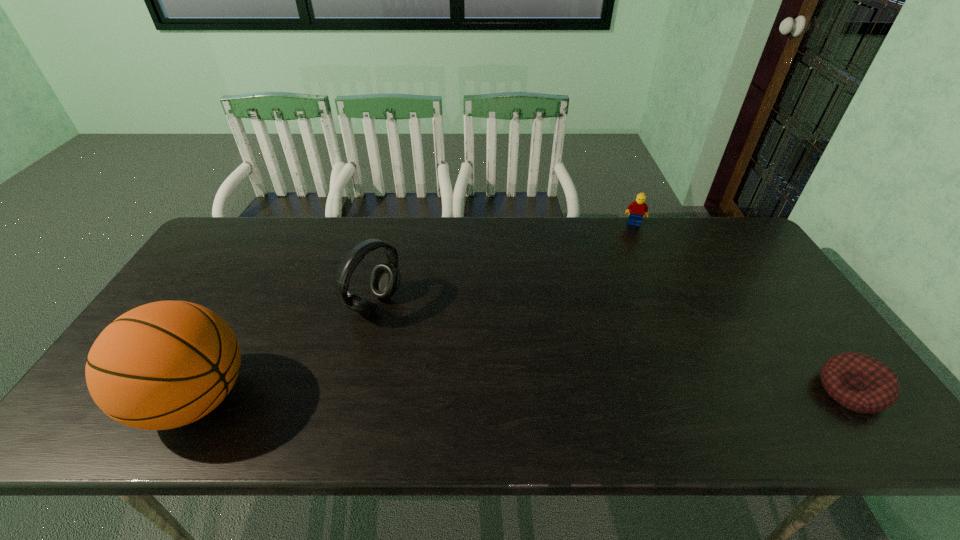
Find the location of a particular element. Image resolution: width=960 pixels, height=540 pixels. basketball is located at coordinates (166, 364).

The width and height of the screenshot is (960, 540). In order to click on the leftmost object in this screenshot , I will do `click(166, 364)`.

Locate an element on the screen. This screenshot has height=540, width=960. the rightmost object is located at coordinates (859, 382).

The height and width of the screenshot is (540, 960). What are the coordinates of `the shortest object` in the screenshot? It's located at (859, 382).

Find the location of a particular element. The width and height of the screenshot is (960, 540). the second farthest object is located at coordinates (384, 281).

Locate an element on the screen. This screenshot has width=960, height=540. the third shortest object is located at coordinates (384, 281).

The height and width of the screenshot is (540, 960). Identify the location of the second object from right to left. (636, 209).

Find the location of a particular element. The image size is (960, 540). the farthest object is located at coordinates (636, 209).

The height and width of the screenshot is (540, 960). Identify the location of vacant space located on the back of the tallest object. tap(251, 298).

You are a GUI agent. You are given a task and a screenshot of the screen. Output one action in this format:
    pyautogui.click(x=<x>, y=<y>)
    Task: Click on the vacant space situated on the left of the beanbag
    
    Given the screenshot: What is the action you would take?
    pyautogui.click(x=785, y=390)